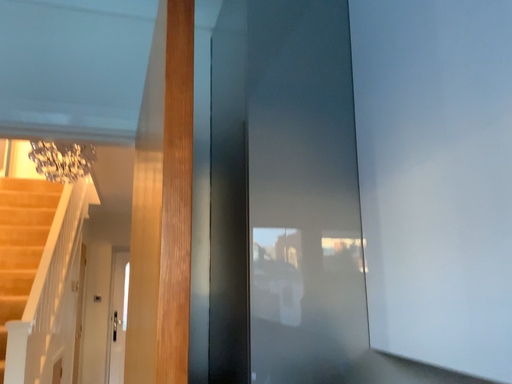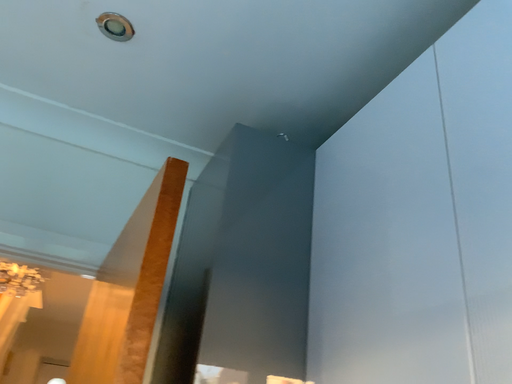
Question: How did the camera likely rotate when shooting the video?

Choices:
 (A) rotated upward
 (B) rotated downward

Answer: (A)